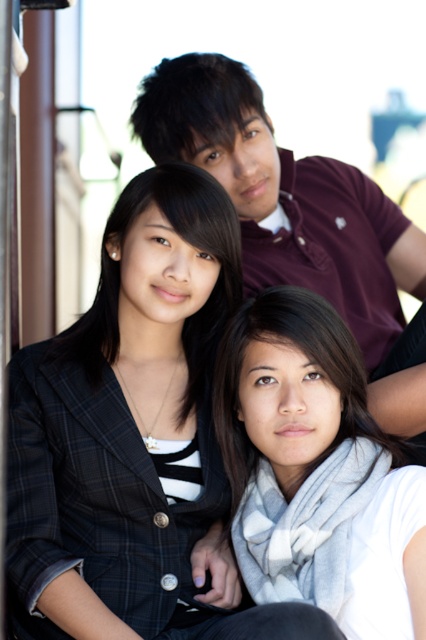
Question: Among these objects, which one is farthest from the camera?

Choices:
 (A) white soft scarf at center
 (B) matte black hair at upper center
 (C) matte black blazer at center

Answer: (B)

Question: Is maroon polo shirt at upper center in front of matte black hair at upper center?

Choices:
 (A) no
 (B) yes

Answer: (B)

Question: Which point appears closest to the camera in this image?

Choices:
 (A) (216, 252)
 (B) (250, 577)

Answer: (B)

Question: Which object is the closest to the matte black hair at upper center?

Choices:
 (A) maroon polo shirt at upper center
 (B) plaid blazer at center
 (C) matte black blazer at center
 (D) white soft scarf at center

Answer: (A)

Question: Does plaid blazer at center appear on the left side of matte black hair at upper center?

Choices:
 (A) no
 (B) yes

Answer: (B)

Question: Does white soft scarf at center lie in front of maroon polo shirt at upper center?

Choices:
 (A) no
 (B) yes

Answer: (B)